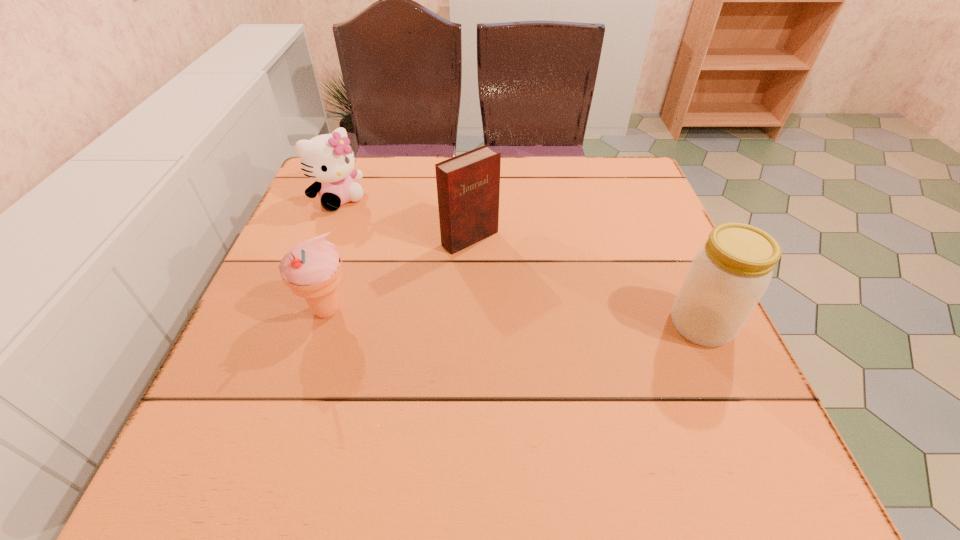
The width and height of the screenshot is (960, 540). Find the location of `vacant space that is in between the third object from left to right and the icecream`. vacant space that is in between the third object from left to right and the icecream is located at coordinates (398, 274).

Find the location of `free space that is in between the farthest object and the jar`. free space that is in between the farthest object and the jar is located at coordinates (520, 262).

Identify the location of vacant area between the kitten and the rightmost object. (520, 262).

The image size is (960, 540). Identify the location of object identified as the second closest to the rightmost object. (312, 269).

Identify which object is the nearest to the second object from right to left. Please provide its 2D coordinates. Your answer should be formatted as a tuple, i.e. [(x, y)], where the tuple contains the x and y coordinates of a point satisfying the conditions above.

[(312, 269)]

At what (x,y) coordinates should I click in order to perform the action: click on vacant position in the image that satisfies the following two spatial constraints: 1. on the front side of the icecream; 2. on the left side of the rightmost object. Please return your answer as a coordinate pair (x, y). Looking at the image, I should click on (323, 325).

At what (x,y) coordinates should I click in order to perform the action: click on vacant area in the image that satisfies the following two spatial constraints: 1. on the front side of the farthest object; 2. on the right side of the jar. Please return your answer as a coordinate pair (x, y). The width and height of the screenshot is (960, 540). Looking at the image, I should click on (290, 325).

The width and height of the screenshot is (960, 540). I want to click on free spot that satisfies the following two spatial constraints: 1. on the front side of the icecream; 2. on the right side of the jar, so click(323, 325).